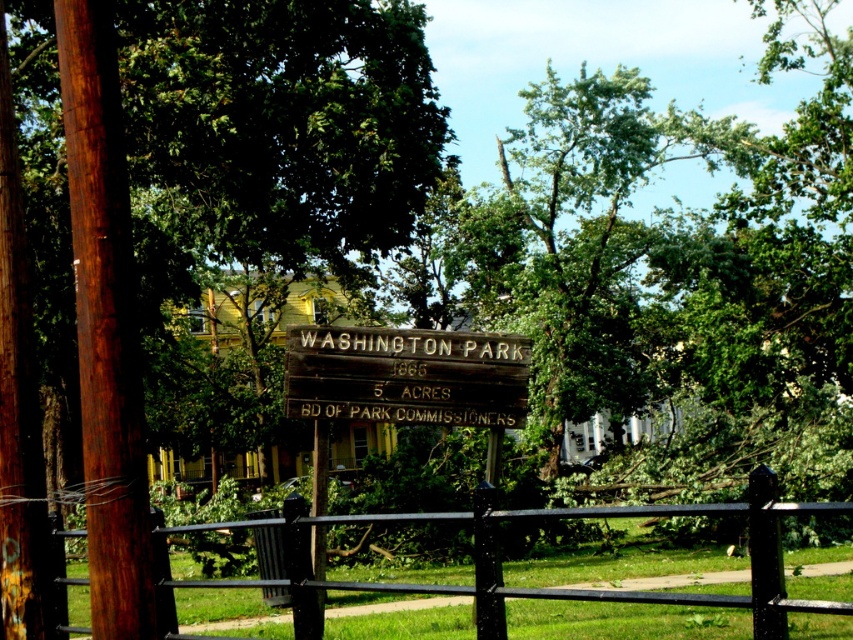
Is green leafy tree at center to the left of wooden sign at center from the viewer's perspective?

Indeed, green leafy tree at center is positioned on the left side of wooden sign at center.

Is point (164, 188) in front of point (334, 344)?

No.

The image size is (853, 640). What do you see at coordinates (273, 131) in the screenshot?
I see `green leafy tree at center` at bounding box center [273, 131].

What are the coordinates of `green leafy tree at center` in the screenshot? It's located at (273, 131).

You are a GUI agent. You are given a task and a screenshot of the screen. Output one action in this format:
    pyautogui.click(x=<x>, y=<y>)
    Task: Click on the wooden sign at center
    The height and width of the screenshot is (640, 853).
    Given the screenshot: What is the action you would take?
    pyautogui.click(x=405, y=376)

Is green leafy tree at center behind black metal fence at center?

That is True.

Looking at this image, can you confirm if green leafy tree at center is bigger than black metal fence at center?

Yes, green leafy tree at center is bigger than black metal fence at center.

Between point (102, 632) and point (769, 576), which one is positioned in front?

Point (769, 576) is more forward.

Where is `green leafy tree at center`? green leafy tree at center is located at coordinates (273, 131).